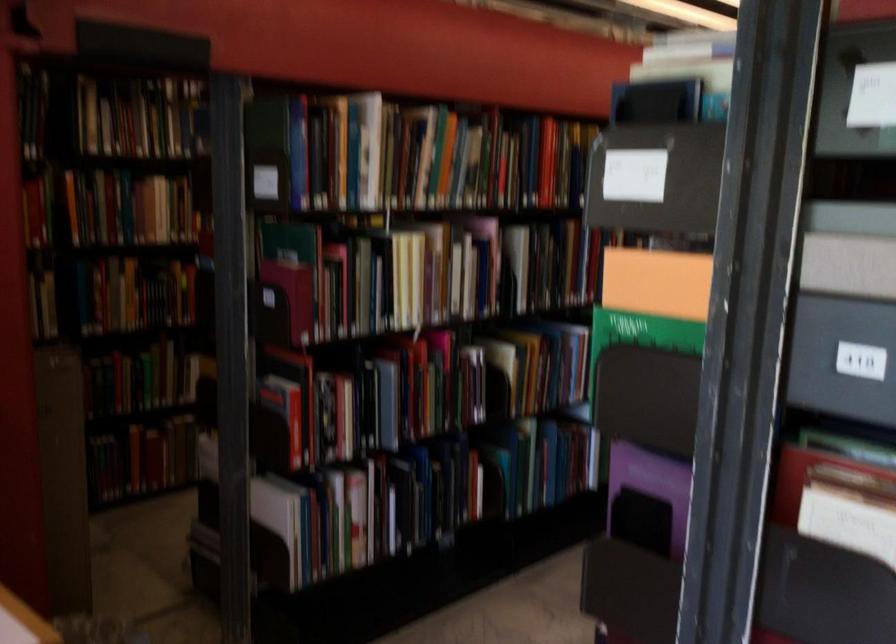
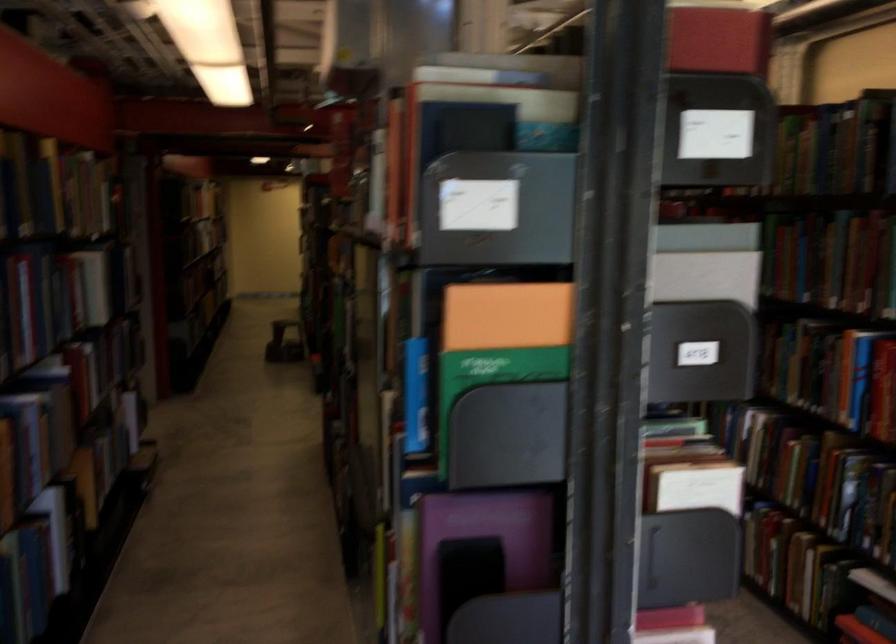
The point at (667, 277) is marked in the first image. Where is the corresponding point in the second image?

(506, 315)